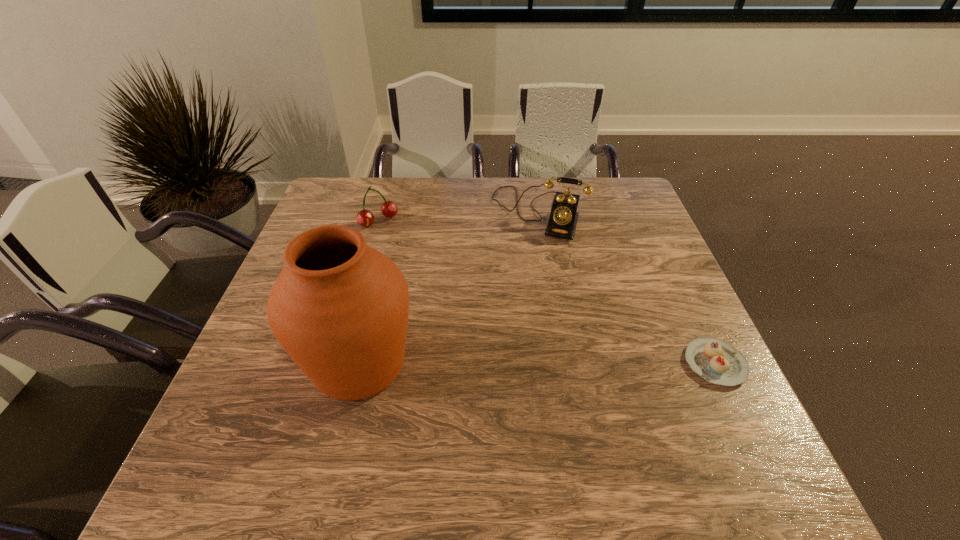
Find the location of a particular element. This screenshot has height=540, width=960. the tallest object is located at coordinates (339, 308).

Where is `the rightmost object`? The image size is (960, 540). the rightmost object is located at coordinates (717, 361).

Identify the location of cupcake. (717, 361).

You are a GUI agent. You are given a task and a screenshot of the screen. Output one action in this format:
    pyautogui.click(x=<x>, y=<y>)
    Task: Click on the second object from right to left
    
    Given the screenshot: What is the action you would take?
    click(562, 223)

Image resolution: width=960 pixels, height=540 pixels. What are the coordinates of `cherry` in the screenshot? It's located at (365, 218).

Where is `blank space located 0.260m on the back of the urn`? Image resolution: width=960 pixels, height=540 pixels. blank space located 0.260m on the back of the urn is located at coordinates (387, 249).

Find the location of a particular element. The width and height of the screenshot is (960, 540). vacant space located on the back of the cupcake is located at coordinates (669, 266).

I want to click on vacant space located 0.400m on the dial of the telephone, so click(x=492, y=351).

The width and height of the screenshot is (960, 540). I want to click on free space located 0.100m on the dial of the telephone, so click(x=522, y=264).

Where is `free space located on the dial of the telephone`? free space located on the dial of the telephone is located at coordinates (505, 315).